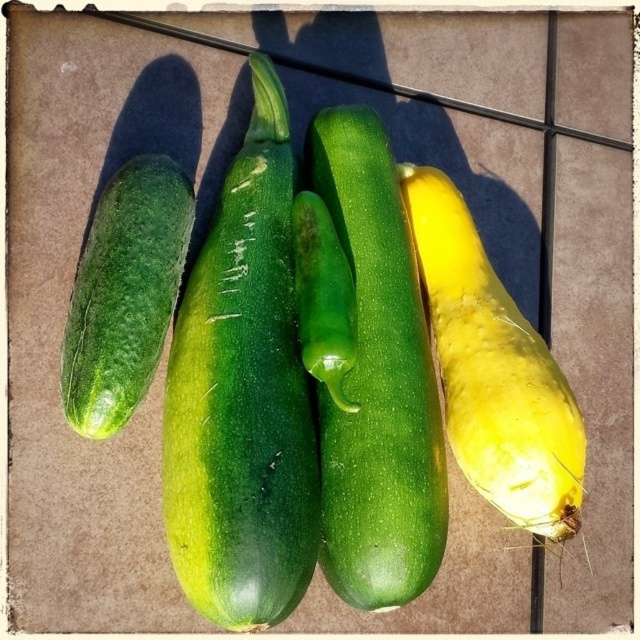
Who is positioned more to the left, green smooth cucumber at center or green matte cucumber at left?

From the viewer's perspective, green matte cucumber at left appears more on the left side.

Looking at this image, does green smooth cucumber at center appear on the left side of green matte cucumber at left?

In fact, green smooth cucumber at center is to the right of green matte cucumber at left.

Image resolution: width=640 pixels, height=640 pixels. Find the location of `green smooth cucumber at center`. green smooth cucumber at center is located at coordinates (378, 381).

I want to click on green smooth cucumber at center, so (378, 381).

Is green matte cucumber at center further to camera compared to green glossy pepper at center?

No, it is not.

How much distance is there between green matte cucumber at center and green glossy pepper at center?

green matte cucumber at center and green glossy pepper at center are 4.56 inches apart from each other.

Between point (276, 381) and point (301, 362), which one is positioned in front?

Point (276, 381) is more forward.

Locate an element on the screen. The width and height of the screenshot is (640, 640). green matte cucumber at center is located at coordinates (243, 396).

Is green matte cucumber at center above yellow matte squash at right?

Yes.

Between green matte cucumber at center and yellow matte squash at right, which one has more height?

Standing taller between the two is green matte cucumber at center.

Who is more distant from viewer, [272,474] or [444,316]?

Positioned behind is point [444,316].

The width and height of the screenshot is (640, 640). What are the coordinates of `green matte cucumber at center` in the screenshot? It's located at [243, 396].